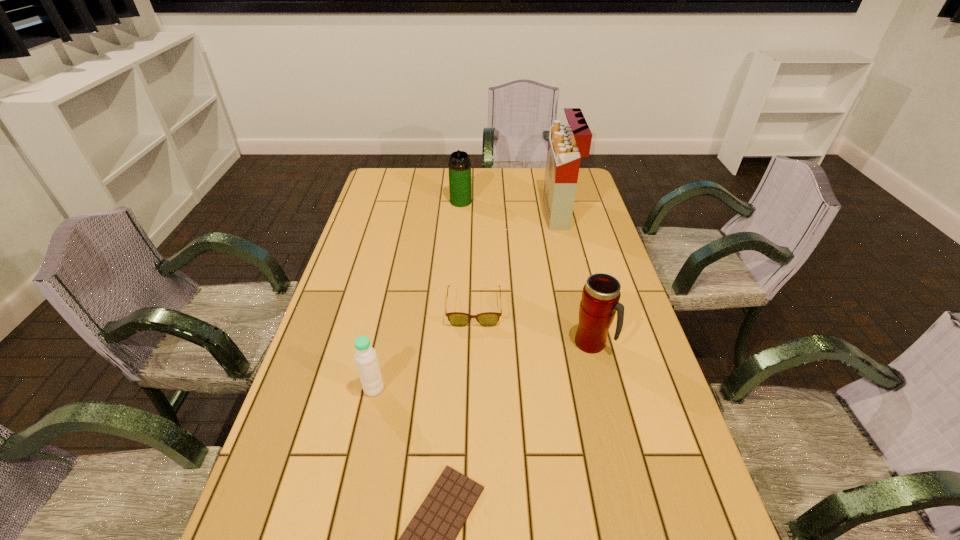
Image resolution: width=960 pixels, height=540 pixels. Find the location of `free space located 0.070m with the lid open on the cigarette case`. free space located 0.070m with the lid open on the cigarette case is located at coordinates (527, 213).

Find the location of a particular element. This screenshot has height=540, width=960. blank space located 0.340m from the spout of the left thermos bottle is located at coordinates (457, 264).

At what (x,y) coordinates should I click in order to perform the action: click on free region located on the side with the handle of the third nearest object. Please return your answer as a coordinate pair (x, y). This screenshot has height=540, width=960. Looking at the image, I should click on (630, 343).

Identify the location of vacant space situated on the right of the leftmost object. This screenshot has height=540, width=960. (438, 388).

This screenshot has height=540, width=960. I want to click on vacant space located at the front view of the third farthest object, so click(473, 361).

You are a GUI agent. You are given a task and a screenshot of the screen. Output one action in this format:
    pyautogui.click(x=<x>, y=<y>)
    Task: Click on the object present at the far edge
    
    Given the screenshot: What is the action you would take?
    pyautogui.click(x=459, y=166)

This screenshot has width=960, height=540. In order to click on object present at the left edge in this screenshot , I will do (x=365, y=356).

Identify the location of cigarette case that is at the right edge. The width and height of the screenshot is (960, 540). (567, 143).

This screenshot has width=960, height=540. Identify the location of thermos bottle that is at the right edge. (600, 299).

The image size is (960, 540). In the image, there is a desktop. In order to click on vacant space at the left edge in this screenshot , I will do `click(298, 529)`.